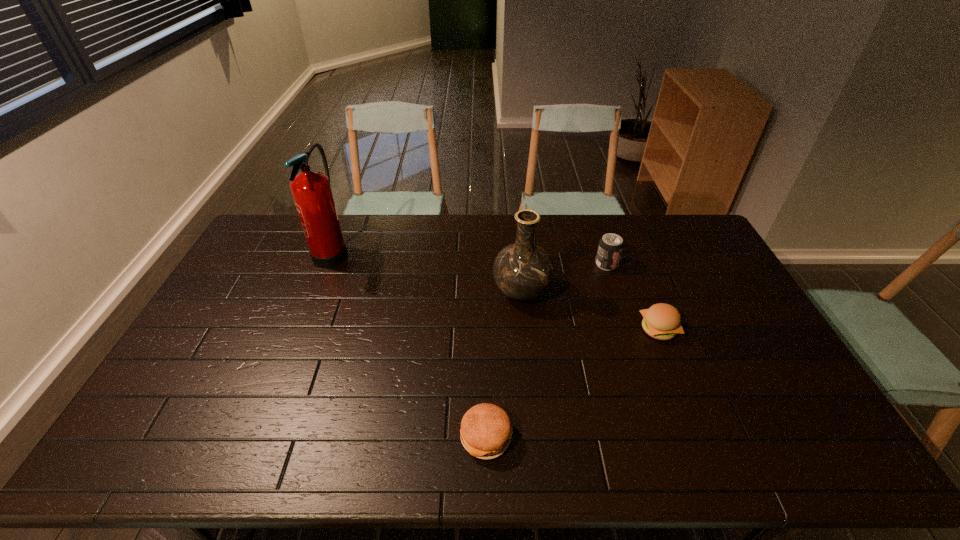
Locate an element on the screen. The image size is (960, 540). vacant space located on the right of the third shortest object is located at coordinates (678, 264).

Find the location of a particular element. The height and width of the screenshot is (540, 960). vacant space located 0.380m on the back of the farther hamburger is located at coordinates (624, 242).

Where is `vacant region located on the left of the left hamburger`? vacant region located on the left of the left hamburger is located at coordinates (300, 437).

The width and height of the screenshot is (960, 540). In order to click on object that is at the far edge in this screenshot , I will do `click(311, 190)`.

Identify the location of object at the near edge. The image size is (960, 540). coord(486,430).

In the image, there is a desktop. Identify the location of vacant space at the far edge. (565, 221).

You are a GUI agent. You are given a task and a screenshot of the screen. Output one action in this format:
    pyautogui.click(x=<x>, y=<y>)
    Task: Click on the vacant point at the near edge
    This screenshot has width=960, height=540.
    Given the screenshot: What is the action you would take?
    pyautogui.click(x=741, y=449)

The height and width of the screenshot is (540, 960). Find the location of `vacant space at the left edge of the desktop`. vacant space at the left edge of the desktop is located at coordinates (249, 312).

Identify the location of vacant space at the far left corner of the desktop. Image resolution: width=960 pixels, height=540 pixels. (273, 216).

Locate an element on the screen. The width and height of the screenshot is (960, 540). vacant point located between the vase and the right hamburger is located at coordinates (589, 310).